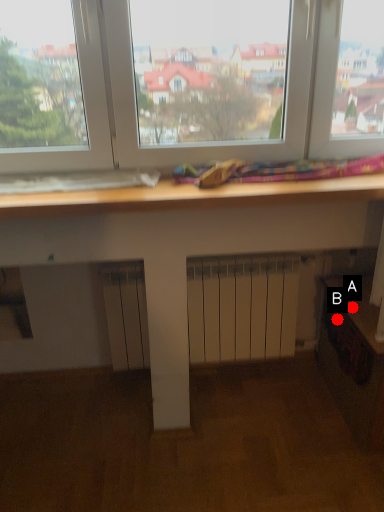
Question: Two points are circled on the image, labeled by A and B beside each circle. Which point is further to the camera?

Choices:
 (A) A is further
 (B) B is further

Answer: (B)